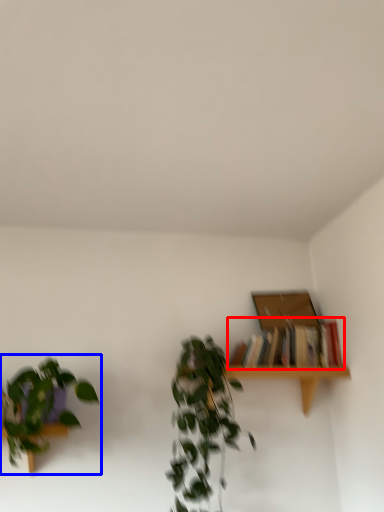
Question: Which object appears farthest to the camera in this image, book (highlighted by a red box) or houseplant (highlighted by a blue box)?

Choices:
 (A) book
 (B) houseplant

Answer: (A)